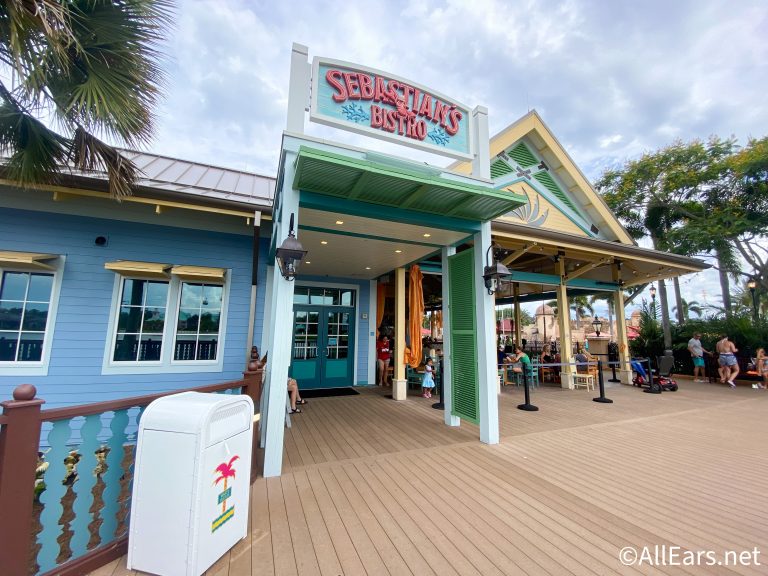
The image size is (768, 576). I want to click on bin, so click(171, 495).